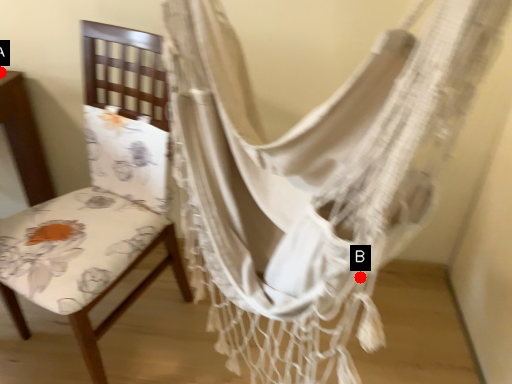
Question: Two points are circled on the image, labeled by A and B beside each circle. Which point is further to the camera?

Choices:
 (A) A is further
 (B) B is further

Answer: (A)